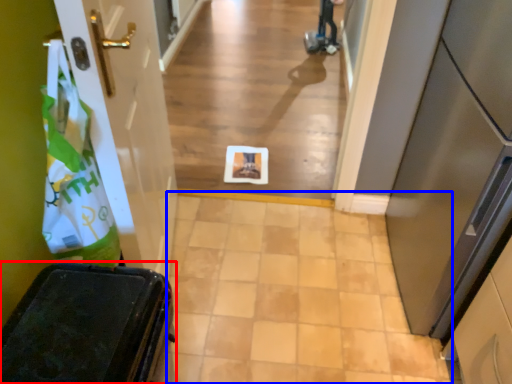
Question: Which object is closer to the camera taking this photo, furniture (highlighted by a red box) or path (highlighted by a blue box)?

Choices:
 (A) furniture
 (B) path

Answer: (A)